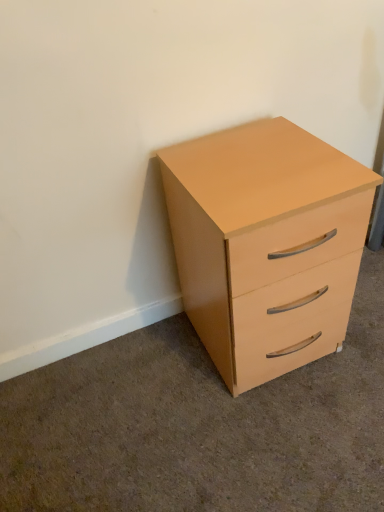
This screenshot has width=384, height=512. In order to click on vacant area that is in front of matte wood chest of drawers at lower right in this screenshot , I will do `click(273, 439)`.